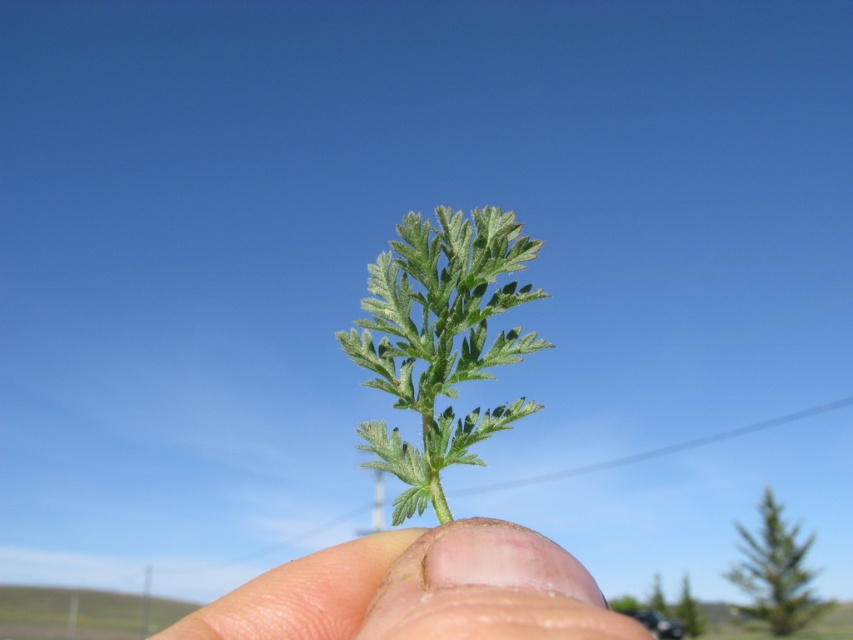
You are holding a plant between your fingers and notice the fleshy skin at center and green fuzzy leaf at center. Which part is wider?

The fleshy skin at center is wider than the green fuzzy leaf at center.

You are holding a plant with your fingers against the sky. You want to know if the fleshy skin at center is above or below the green fuzzy leaf at center. Can you tell me?

The fleshy skin at center is positioned under green fuzzy leaf at center, so the fleshy skin at center is below the green fuzzy leaf at center.